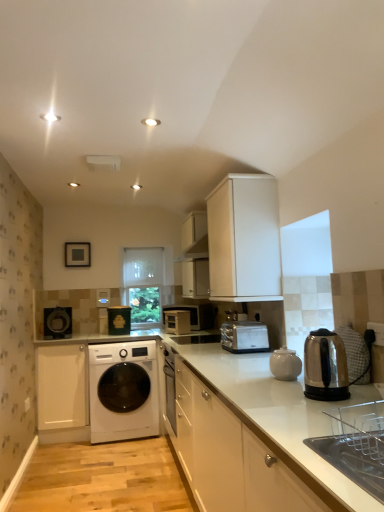
Question: Is white glossy cabinet at center, which is the first cabinetry from right to left, bigger or smaller than stainless steel kettle at right, which appears as the second home appliance when viewed from the back?

Choices:
 (A) small
 (B) big

Answer: (B)

Question: Is white glossy cabinet at center, the fourth cabinetry when ordered from left to right, wider or thinner than stainless steel kettle at right, which ranks as the first home appliance in front-to-back order?

Choices:
 (A) thin
 (B) wide

Answer: (B)

Question: Estimate the real-world distances between objects in this image. Which object is farther from the white glossy teapot at center?

Choices:
 (A) white matte cabinet at upper center, the 2th cabinetry from the right
 (B) white matte cabinet at lower left, the 1th cabinetry viewed from the left
 (C) stainless steel kettle at right, which ranks as the first home appliance in front-to-back order
 (D) white glossy cabinet at center, placed as the 2th cabinetry when sorted from left to right
 (E) white glossy cabinet at center, which is the first cabinetry from right to left

Answer: (B)

Question: Which object is the farthest from the white glossy teapot at center?

Choices:
 (A) matte black toaster at center, which is the 2th appliance from right to left
 (B) matte black washing machine at left, positioned as the 1th appliance in left-to-right order
 (C) white glossy cabinet at center, the fourth cabinetry when ordered from left to right
 (D) white glossy cabinet at center, placed as the 2th cabinetry when sorted from left to right
 (E) transparent plastic window screen at center, placed as the first window screen when sorted from top to bottom

Answer: (E)